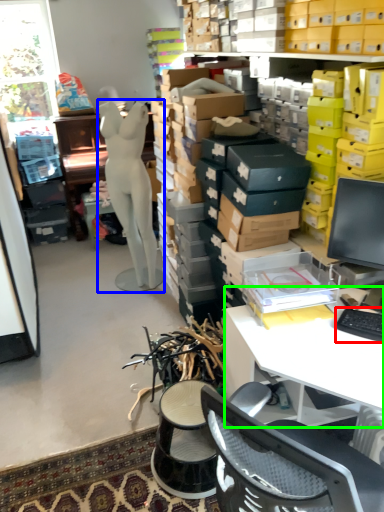
Question: Which object is positioned farthest from computer keyboard (highlighted by a red box)? Select from person (highlighted by a blue box) and desk (highlighted by a green box).

Choices:
 (A) person
 (B) desk

Answer: (A)